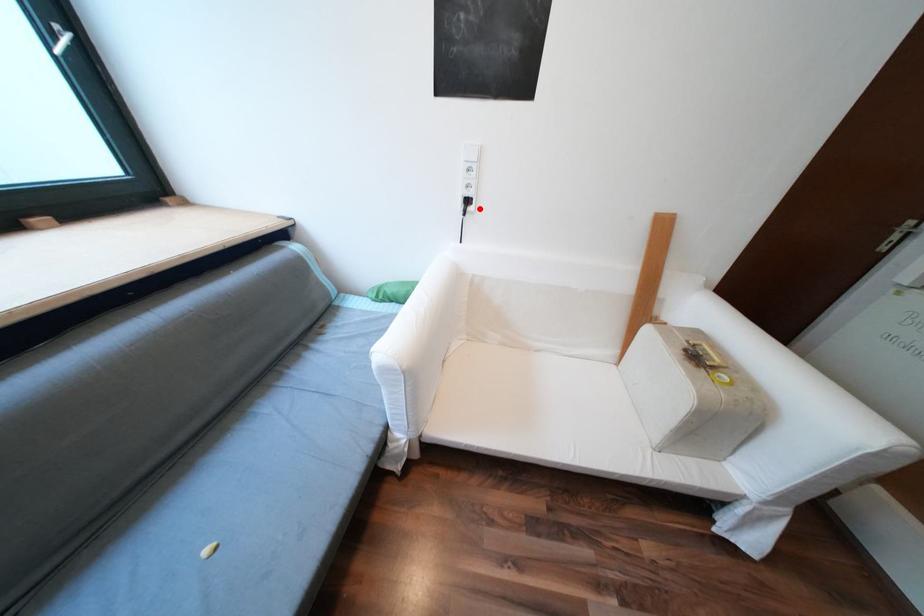
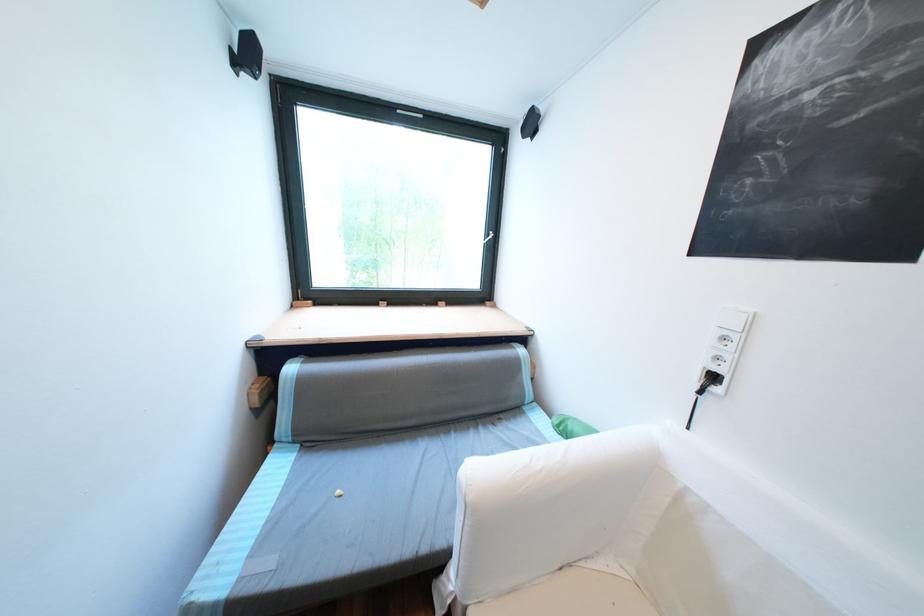
Locate, in the second image, the point that corresponds to the highlighted location in the first image.

(725, 390)